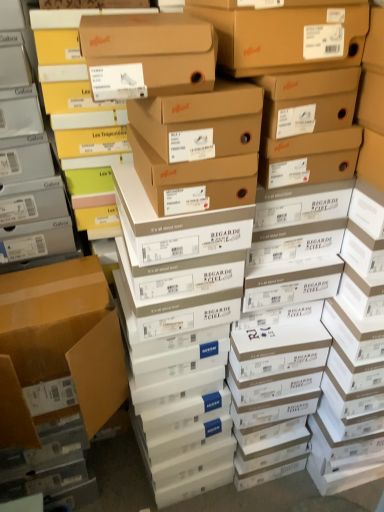
Question: Considering the positions of matte gray shoebox at left and matte cardboard box at left in the image, is matte gray shoebox at left taller or shorter than matte cardboard box at left?

Choices:
 (A) tall
 (B) short

Answer: (A)

Question: Visually, is matte gray shoebox at left positioned to the left or to the right of matte cardboard box at left?

Choices:
 (A) right
 (B) left

Answer: (B)

Question: In the image, is matte gray shoebox at left positioned in front of or behind matte cardboard box at left?

Choices:
 (A) front
 (B) behind

Answer: (A)

Question: From the image's perspective, is matte cardboard box at left positioned above or below matte gray shoebox at left?

Choices:
 (A) above
 (B) below

Answer: (B)

Question: Do you think matte cardboard box at left is within matte gray shoebox at left, or outside of it?

Choices:
 (A) inside
 (B) outside

Answer: (B)

Question: Is matte cardboard box at left in front of or behind matte gray shoebox at left in the image?

Choices:
 (A) behind
 (B) front

Answer: (A)

Question: Is point (120, 351) closer or farther from the camera than point (59, 225)?

Choices:
 (A) closer
 (B) farther

Answer: (A)